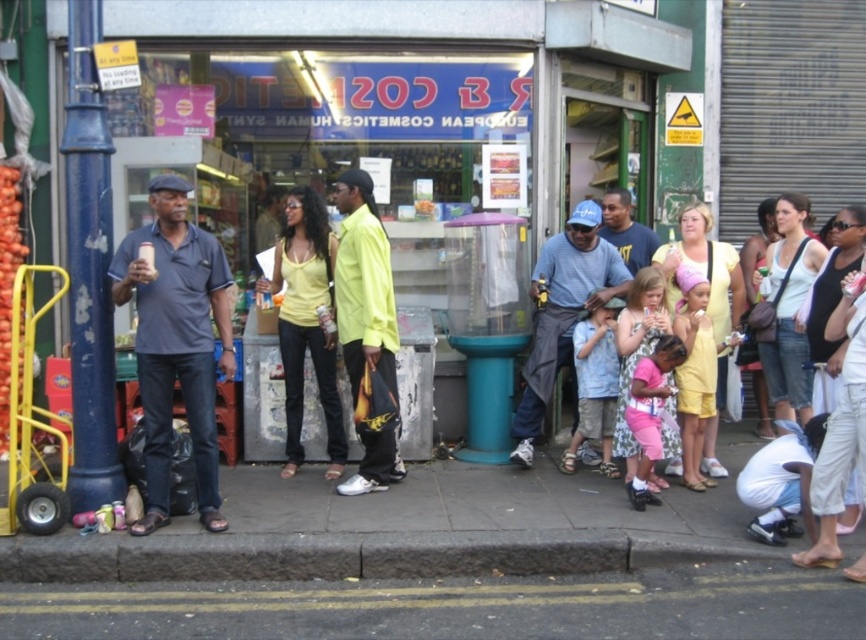
Question: Is black asphalt at lower center positioned in front of dark blue shirt at left?

Choices:
 (A) no
 (B) yes

Answer: (B)

Question: Which object is farther from the camera taking this photo?

Choices:
 (A) dark gray concrete curb at lower center
 (B) black asphalt at lower center
 (C) matte blue shirt at center

Answer: (C)

Question: Which of the following is the closest to the observer?

Choices:
 (A) (608, 202)
 (B) (216, 476)
 (C) (488, 560)
 (D) (557, 358)

Answer: (C)

Question: Among these objects, which one is nearest to the camera?

Choices:
 (A) matte yellow tank top at center
 (B) neon yellow shirt at center
 (C) dark gray concrete curb at lower center
 (D) dark blue shirt at left

Answer: (C)

Question: Is black asphalt at lower center thinner than dark blue shirt at left?

Choices:
 (A) yes
 (B) no

Answer: (B)

Question: Where is dark blue shirt at left located in relation to matte yellow tank top at center in the image?

Choices:
 (A) right
 (B) left

Answer: (B)